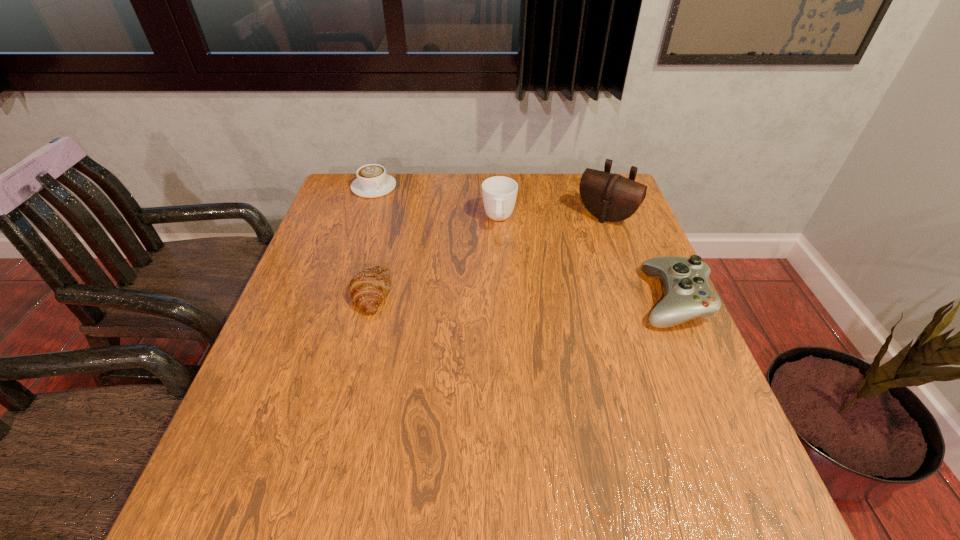
Find the location of a particular element. crescent roll is located at coordinates (367, 289).

This screenshot has height=540, width=960. In order to click on control in this screenshot , I will do `click(687, 295)`.

This screenshot has width=960, height=540. I want to click on the farthest object, so pyautogui.click(x=372, y=181).

Identify the location of the third object from left to right. (499, 193).

In order to click on pouch in this screenshot , I will do `click(610, 197)`.

This screenshot has width=960, height=540. Find the location of `vacant region located on the back of the crescent roll`. vacant region located on the back of the crescent roll is located at coordinates (397, 192).

At what (x,y) coordinates should I click in order to perform the action: click on vacant space located on the front of the third tallest object. Please return your answer as a coordinate pair (x, y). The height and width of the screenshot is (540, 960). Looking at the image, I should click on (700, 363).

You are a GUI agent. You are given a task and a screenshot of the screen. Output one action in this format:
    pyautogui.click(x=<x>, y=<y>)
    Task: Click on the vacant space situated with the handle on the right side of the farthest object
    Image resolution: width=960 pixels, height=540 pixels.
    Given the screenshot: What is the action you would take?
    pyautogui.click(x=416, y=230)

Locate an element on the screen. The width and height of the screenshot is (960, 540). vacant area situated 0.310m with the handle on the right side of the farthest object is located at coordinates (433, 248).

Locate an element on the screen. The height and width of the screenshot is (540, 960). blank space located with the handle on the right side of the farthest object is located at coordinates (444, 260).